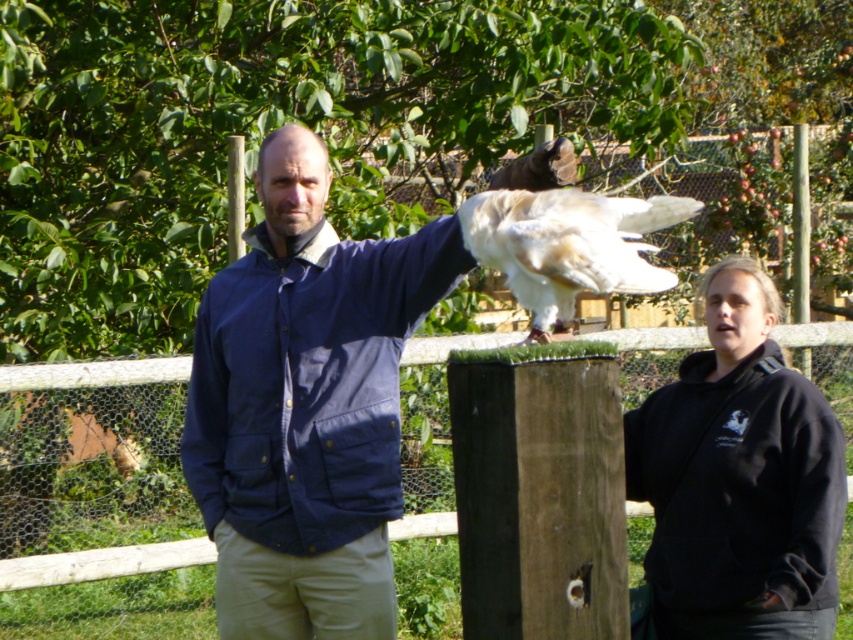
You are a photographer trying to capture a clear photo of the white feathered bird at center. The blue cotton jacket at center is blocking part of the bird. Can you adjust your position to get a better shot without moving the jacket or the bird?

The blue cotton jacket at center is larger in size than the white feathered bird at center, so moving your camera position slightly to the side might allow you to frame the shot so the bird is no longer obscured by the jacket.

You are a photographer trying to capture the exact location of the blue cotton jacket at center in the scene. According to the coordinates provided, where should you focus your camera lens to ensure the jacket is centered in the frame?

To center the blue cotton jacket at center in the frame, focus your camera lens at the coordinates point (306, 404) as specified.